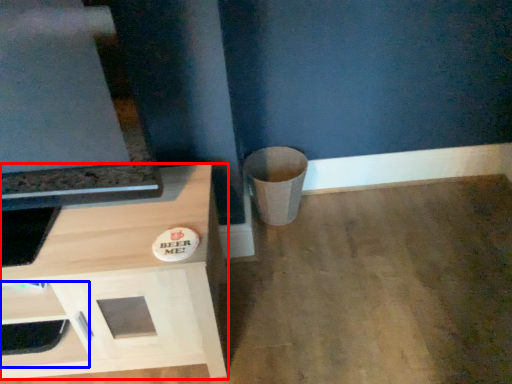
Question: Which object appears farthest to the camera in this image, cabinetry (highlighted by a red box) or drawer (highlighted by a blue box)?

Choices:
 (A) cabinetry
 (B) drawer

Answer: (B)